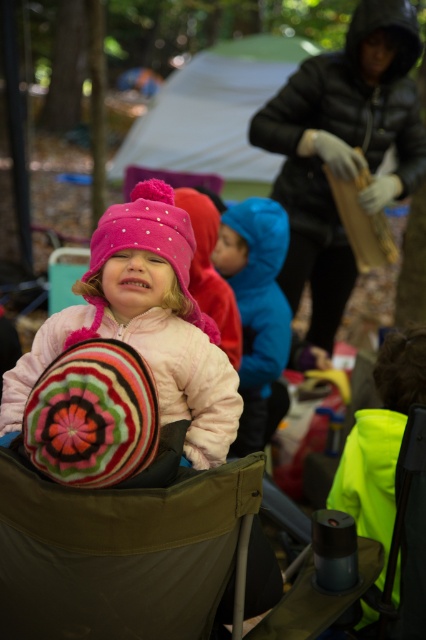
Between green fabric folding chair at center and pink fleece jacket at center, which one has more height?

With more height is pink fleece jacket at center.

From the picture: Who is more forward, (28, 632) or (147, 198)?

Point (28, 632) is more forward.

Where is `green fabric folding chair at center`? green fabric folding chair at center is located at coordinates (118, 554).

Does green fabric folding chair at center come behind blue fuzzy jacket at center?

No, green fabric folding chair at center is closer to the viewer.

Is point (154, 620) more distant than point (238, 296)?

That is False.

You are a GUI agent. You are given a task and a screenshot of the screen. Output one action in this format:
    pyautogui.click(x=<x>, y=<y>)
    Task: Click on the green fabric folding chair at center
    
    Given the screenshot: What is the action you would take?
    point(118,554)

Can you confirm if white fabric tent at upper center is bigger than blue fuzzy jacket at center?

Yes, white fabric tent at upper center is bigger than blue fuzzy jacket at center.

Consider the image. Is white fabric tent at upper center above blue fuzzy jacket at center?

Indeed, white fabric tent at upper center is positioned over blue fuzzy jacket at center.

Does point (270, 61) lie in front of point (256, 216)?

No, it is not.

Locate an element on the screen. white fabric tent at upper center is located at coordinates (215, 109).